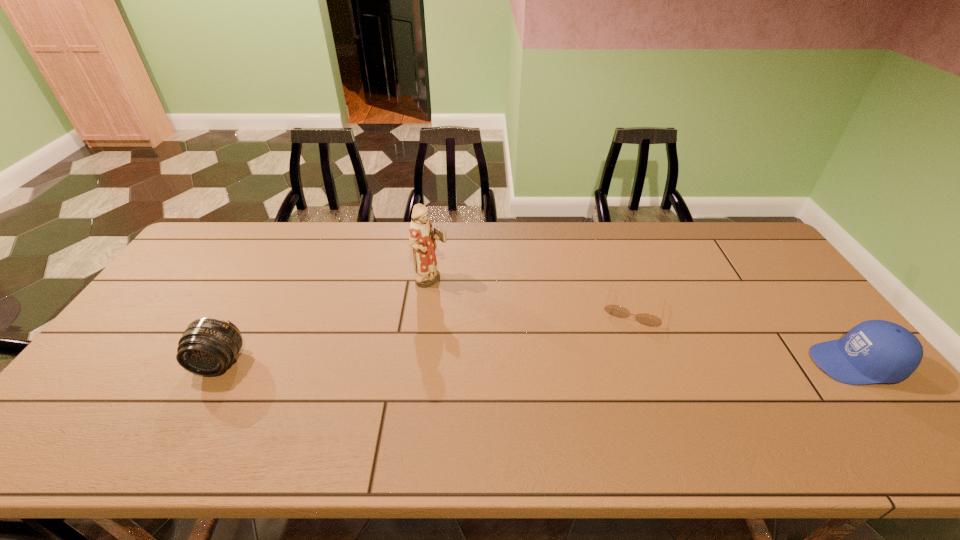
At what (x,y) coordinates should I click in order to perform the action: click on free space at the near edge. Please return your answer as a coordinate pair (x, y). Looking at the image, I should click on (152, 413).

Locate an element on the screen. The height and width of the screenshot is (540, 960). free spot at the left edge of the desktop is located at coordinates (183, 291).

This screenshot has width=960, height=540. In the image, there is a desktop. What are the coordinates of `vacant space at the far left corner` in the screenshot? It's located at (225, 246).

This screenshot has width=960, height=540. Find the location of `vacant area that lies between the leftmost object and the tallest object`. vacant area that lies between the leftmost object and the tallest object is located at coordinates (325, 322).

This screenshot has width=960, height=540. Identify the location of empty space between the second object from right to left and the cap. (745, 336).

The height and width of the screenshot is (540, 960). I want to click on free space that is in between the telephoto lens and the third object from left to right, so click(427, 335).

The image size is (960, 540). I want to click on free space between the cap and the telephoto lens, so pyautogui.click(x=538, y=363).

Where is `free space between the telephoto lens and the figurine`? The image size is (960, 540). free space between the telephoto lens and the figurine is located at coordinates (325, 322).

The height and width of the screenshot is (540, 960). I want to click on free space between the rightmost object and the telephoto lens, so click(x=538, y=363).

Where is `object that is the closest one to the tallest object`? The width and height of the screenshot is (960, 540). object that is the closest one to the tallest object is located at coordinates (646, 319).